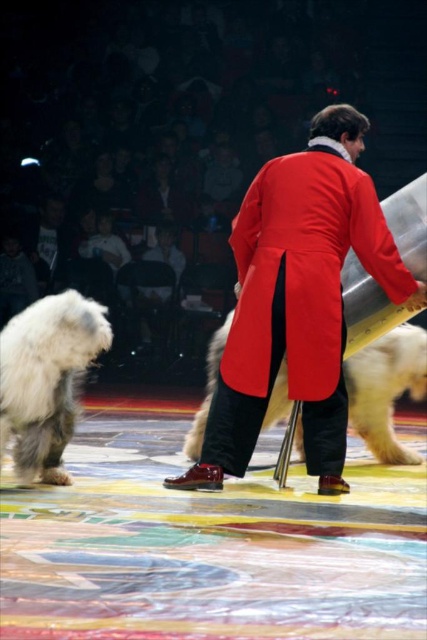
Who is shorter, shiny red coat at center or white fluffy dog at center?

Standing shorter between the two is white fluffy dog at center.

Which is behind, point (292, 282) or point (397, 355)?

Point (397, 355)

Locate an element on the screen. The height and width of the screenshot is (640, 427). shiny red coat at center is located at coordinates (298, 300).

Between shiny red coat at center and white fluffy dog at lower left, which one is positioned lower?

white fluffy dog at lower left is lower down.

Is shiny red coat at center positioned at the back of white fluffy dog at lower left?

That is True.

Which is in front, point (321, 428) or point (72, 378)?

Point (321, 428) is in front.

This screenshot has width=427, height=640. I want to click on shiny red coat at center, so click(298, 300).

Measure the distance between point (73,403) and camera.

4.24 meters

At what (x,y) coordinates should I click in order to perform the action: click on white fluffy dog at lower left. Please return your answer as a coordinate pair (x, y). Image resolution: width=427 pixels, height=640 pixels. Looking at the image, I should click on (46, 378).